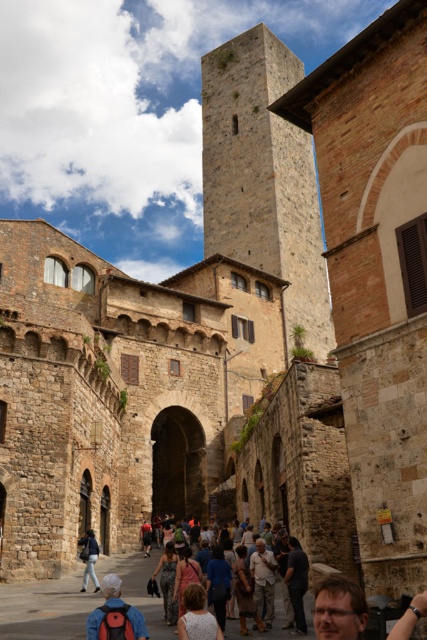
You are standing on the cobblestone street in front of the rustic stone tower at center and the light beige fabric shirt at center. Which object is taller?

The rustic stone tower at center is taller than the light beige fabric shirt at center according to the description.

You are standing at the base of the tall stone tower in the historic town. You want to take a photo of a specific point located at coordinates point (x=142, y=621). Your camera has a maximum focus range of 75 feet. Will the camera be able to focus on the point?

The distance of point (x=142, y=621) from camera is 74.60 feet, which is within the camera maximum focus range of 75 feet. The camera can focus on the point.

You are a tailor visiting this historic town and need to determine if the dark gray fabric at lower center can be used to make a new denim jacket at center. Based on their widths, will there be enough fabric?

The dark gray fabric at lower center has a width less than the denim jacket at center, so there may not be enough fabric to make the denim jacket at center unless additional fabric is added.